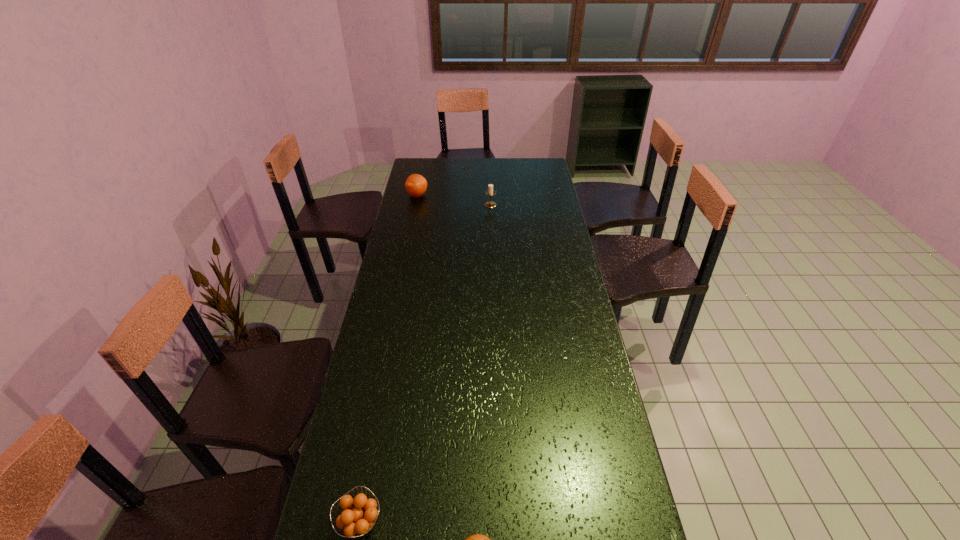
Identify the location of object that is the second closest to the tallest orange fruit. Image resolution: width=960 pixels, height=540 pixels. (358, 518).

Identify the location of object that is the second nearest to the candle holder. The height and width of the screenshot is (540, 960). (358, 518).

The image size is (960, 540). Identify the location of the second closest orange fruit to the farthest orange fruit. (477, 539).

Where is `orange fruit identified as the third closest to the candle holder`? This screenshot has height=540, width=960. orange fruit identified as the third closest to the candle holder is located at coordinates (477, 539).